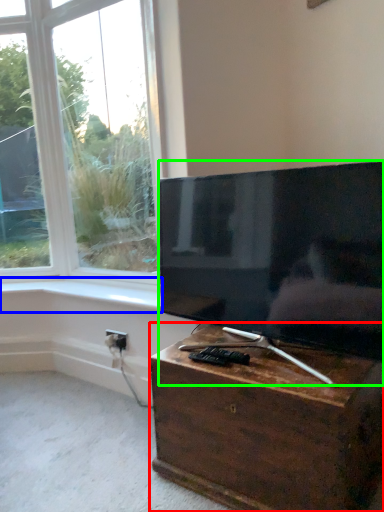
Question: Estimate the real-world distances between objects in this image. Which object is closer to nightstand (highlighted by a red box), window sill (highlighted by a blue box) or television (highlighted by a green box)?

Choices:
 (A) window sill
 (B) television

Answer: (B)